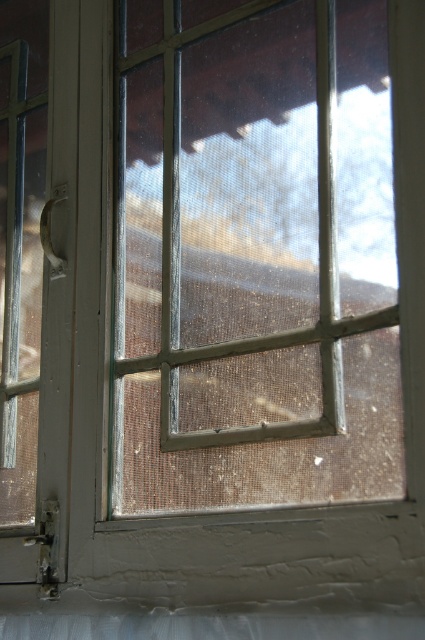
You are trying to clean the clear glass window at center and the white textured curtain at bottom. Which object is located to the left of the other?

The clear glass window at center is positioned on the right side of white textured curtain at bottom, so the white textured curtain at bottom is to the left of the clear glass window at center.